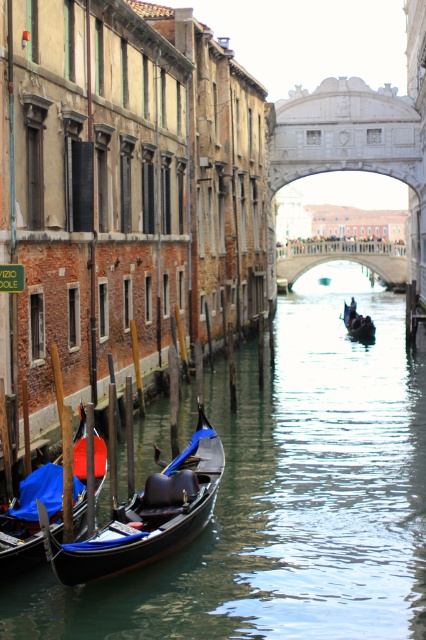
Question: Among these points, which one is farthest from the camera?

Choices:
 (A) (417, 611)
 (B) (77, 496)
 (C) (354, 316)

Answer: (C)

Question: From the image, what is the correct spatial relationship of blue velvet gondola at lower left in relation to white stone bridge at center?

Choices:
 (A) right
 (B) left

Answer: (B)

Question: Does clear water at canal center have a greater width compared to white stone bridge at center?

Choices:
 (A) yes
 (B) no

Answer: (A)

Question: Which point is closer to the camera?

Choices:
 (A) (348, 324)
 (B) (293, 260)
 (C) (17, 556)

Answer: (C)

Question: Does blue velvet gondola at lower left come in front of black polished wood gondola at center?

Choices:
 (A) yes
 (B) no

Answer: (A)

Question: Which object is farther from the camera taking this photo?

Choices:
 (A) clear water at canal center
 (B) blue velvet gondola at lower left
 (C) black polished wood gondola at center

Answer: (C)